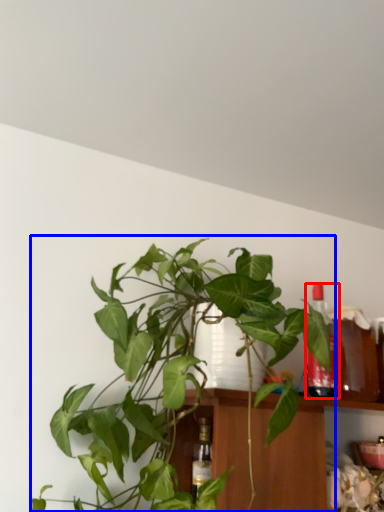
Question: Which point is further to the camera, bottle (highlighted by a red box) or houseplant (highlighted by a blue box)?

Choices:
 (A) bottle
 (B) houseplant

Answer: (A)